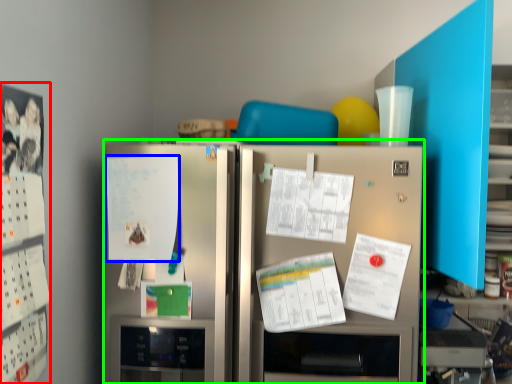
Question: Estimate the real-world distances between objects in this image. Which object is farther from bulletin board (highlighted by a red box), poster (highlighted by a blue box) or refrigerator (highlighted by a green box)?

Choices:
 (A) poster
 (B) refrigerator

Answer: (B)